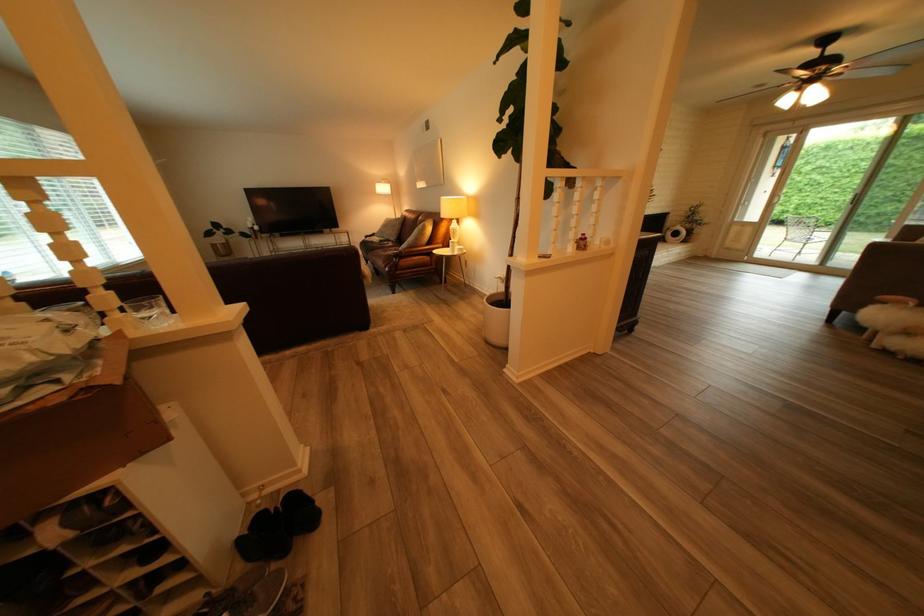
Where is `small red bottle`? Image resolution: width=924 pixels, height=616 pixels. small red bottle is located at coordinates (581, 241).